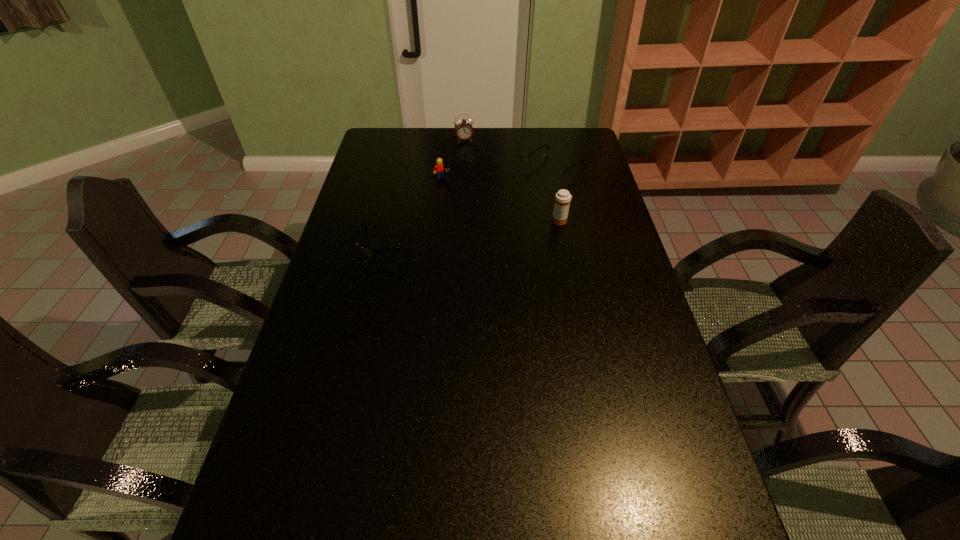
Locate an element on the screen. Image resolution: width=960 pixels, height=540 pixels. unoccupied area between the medicine and the Lego is located at coordinates (501, 200).

You are a GUI agent. You are given a task and a screenshot of the screen. Output one action in this format:
    pyautogui.click(x=<x>, y=<y>)
    Task: Click on the empty space between the right spectacles and the third object from left to right
    
    Given the screenshot: What is the action you would take?
    pyautogui.click(x=509, y=154)

In order to click on vacant area that lies between the shorter spectacles and the alarm clock in this screenshot , I will do `click(424, 191)`.

Locate an element on the screen. The height and width of the screenshot is (540, 960). free space between the Lego and the farther spectacles is located at coordinates (498, 174).

Locate an element on the screen. The image size is (960, 540). free spot between the alarm clock and the farther spectacles is located at coordinates (509, 154).

The image size is (960, 540). Identify the location of free area in between the nearer spectacles and the medicine. (x=472, y=231).

Identify the location of free space between the Lego and the medicine. The width and height of the screenshot is (960, 540). (501, 200).

Select which object is the fourth closest to the shortest object. Please provide its 2D coordinates. Your answer should be formatted as a tuple, i.e. [(x, y)], where the tuple contains the x and y coordinates of a point satisfying the conditions above.

[(463, 128)]

Locate which object ranks fourth in proximity to the Lego. Please provide its 2D coordinates. Your answer should be formatted as a tuple, i.e. [(x, y)], where the tuple contains the x and y coordinates of a point satisfying the conditions above.

[(562, 198)]

What are the coordinates of `free space that satisfies the following two spatial constraints: 1. on the back side of the third object from right to left; 2. on the right side of the fourth object from right to left` in the screenshot? It's located at pyautogui.click(x=446, y=140).